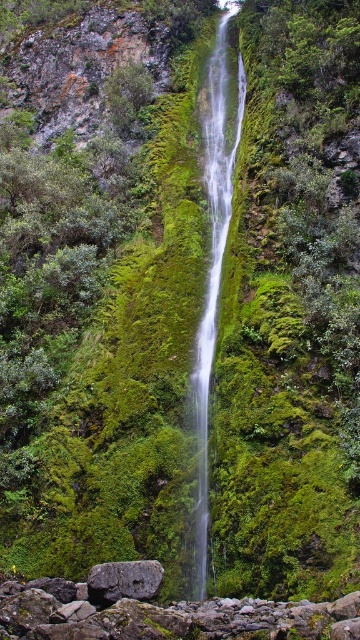
Looking at this image, who is positioned more to the left, clear glass waterfall at center or gray rough rock at lower center?

From the viewer's perspective, gray rough rock at lower center appears more on the left side.

Locate an element on the screen. This screenshot has height=640, width=360. clear glass waterfall at center is located at coordinates (213, 250).